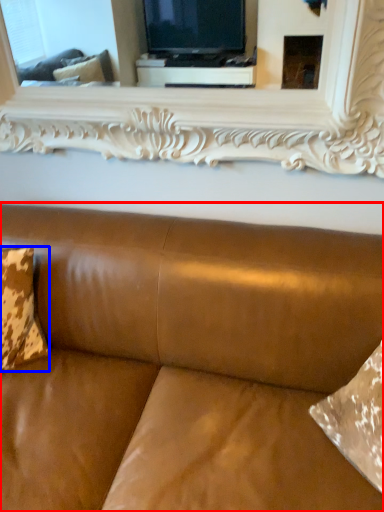
Question: Which object is closer to the camera taking this photo, studio couch (highlighted by a red box) or pillow (highlighted by a blue box)?

Choices:
 (A) studio couch
 (B) pillow

Answer: (A)